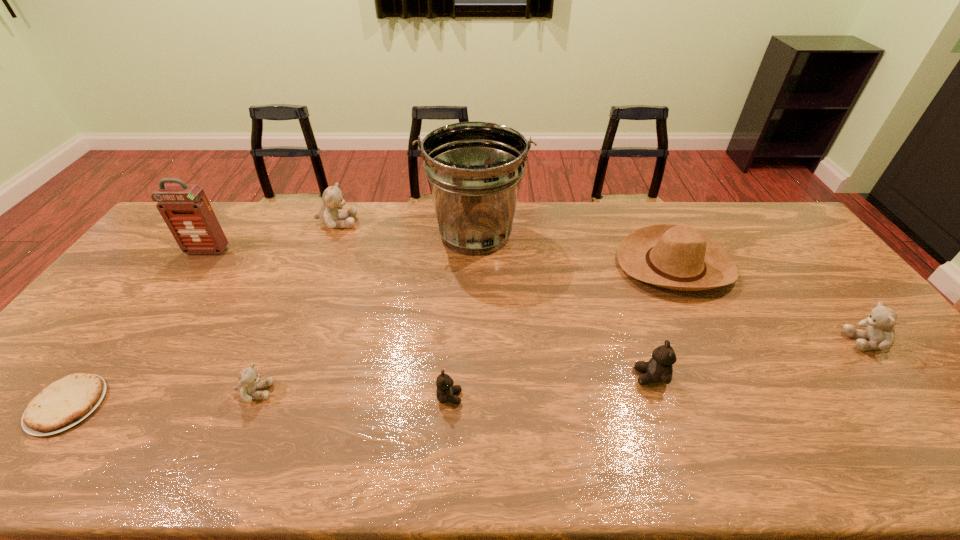
Where is `the third teddy bear from right to left`? Image resolution: width=960 pixels, height=540 pixels. the third teddy bear from right to left is located at coordinates 446,391.

Locate an element on the screen. The image size is (960, 540). the smaller brown teddy bear is located at coordinates (446, 391).

The width and height of the screenshot is (960, 540). In order to click on the smallest gray teddy bear in this screenshot , I will do `click(249, 380)`.

Image resolution: width=960 pixels, height=540 pixels. What are the coordinates of `the shortest object` in the screenshot? It's located at (64, 403).

Identify the location of beige tortilla. (64, 403).

Identify the location of vacant space located on the front of the bucket. The width and height of the screenshot is (960, 540). (474, 337).

At what (x,y) coordinates should I click in order to perform the action: click on free space located on the front-facing side of the red first-aid kit. Please return your answer as a coordinate pair (x, y). Image resolution: width=960 pixels, height=540 pixels. Looking at the image, I should click on (166, 309).

Locate an element on the screen. The image size is (960, 540). free spot located 0.110m on the face of the tallest teddy bear is located at coordinates (388, 223).

Find the location of `vacant position located 0.200m on the front-facing side of the cowboy hat`. vacant position located 0.200m on the front-facing side of the cowboy hat is located at coordinates (718, 354).

This screenshot has height=540, width=960. I want to click on vacant area situated 0.050m on the face of the right brown teddy bear, so click(614, 376).